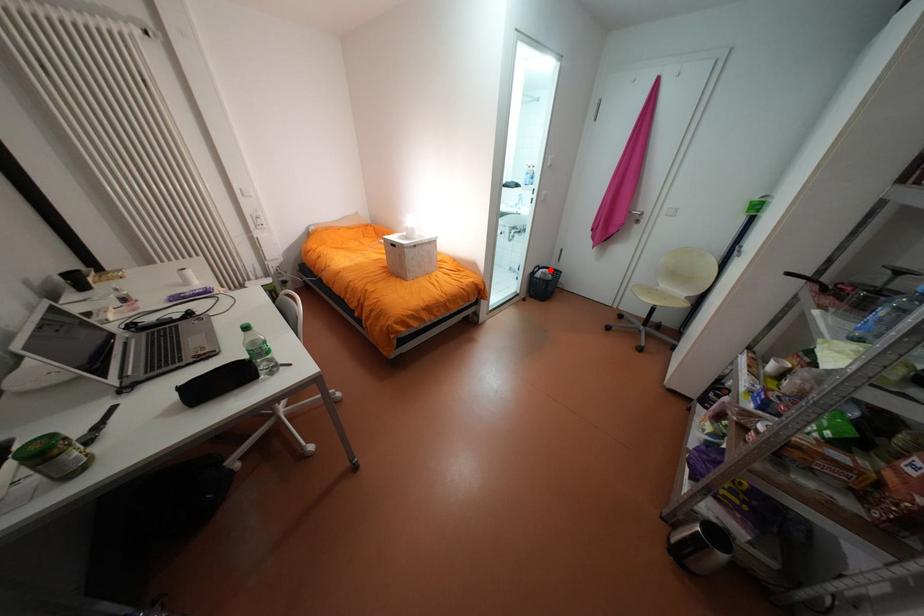
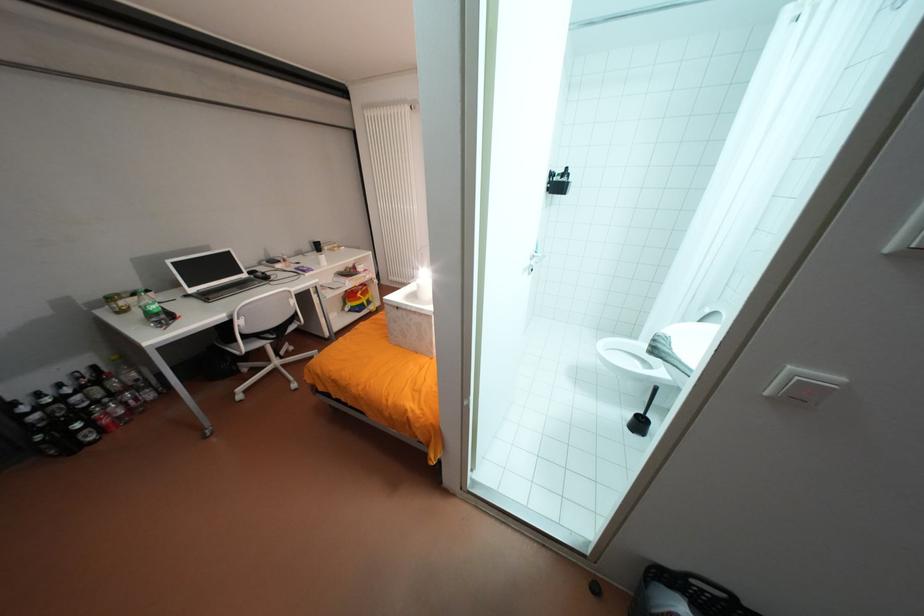
Question: A red point is marked in image1. In image2, is the corresponding 3D point closer to the camera or farther? Reply with the corresponding letter.

Choices:
 (A) The corresponding 3D point is closer.
 (B) The corresponding 3D point is farther.

Answer: (A)